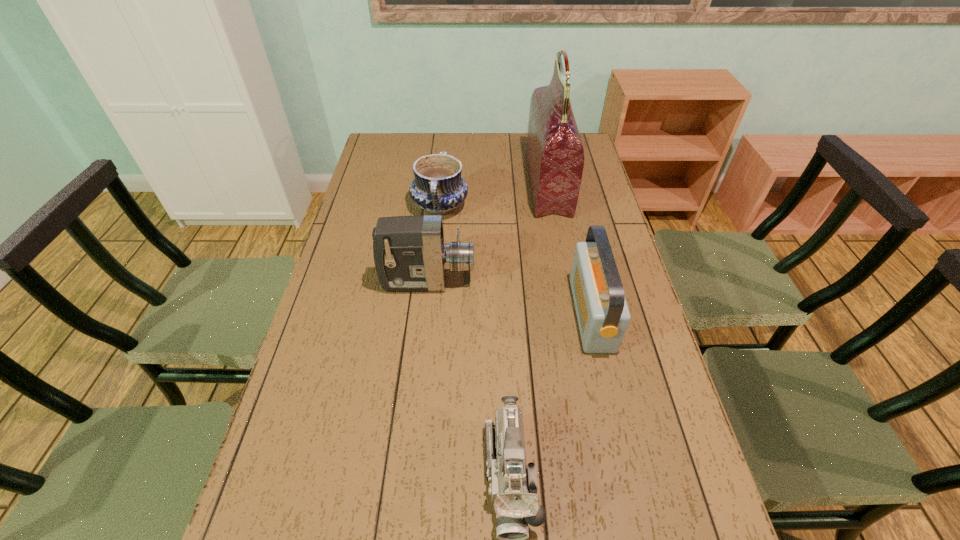
Where is `free spot at the right edge of the desktop`? free spot at the right edge of the desktop is located at coordinates (622, 261).

Find the location of a particular element. vacant space at the far right corner of the desktop is located at coordinates (586, 138).

Find the location of a particular element. empty space between the handbag and the radio receiver is located at coordinates (570, 249).

Locate an element on the screen. The image size is (960, 540). vacant area that lies between the pottery and the tallest object is located at coordinates tap(494, 195).

The image size is (960, 540). Identify the location of vacant space in between the radio receiver and the handbag. (570, 249).

Identify which object is the nearest to the handbag. Please provide its 2D coordinates. Your answer should be formatted as a tuple, i.e. [(x, y)], where the tuple contains the x and y coordinates of a point satisfying the conditions above.

[(438, 188)]

Find the location of a particular element. object that is the third closest one to the left camcorder is located at coordinates (555, 155).